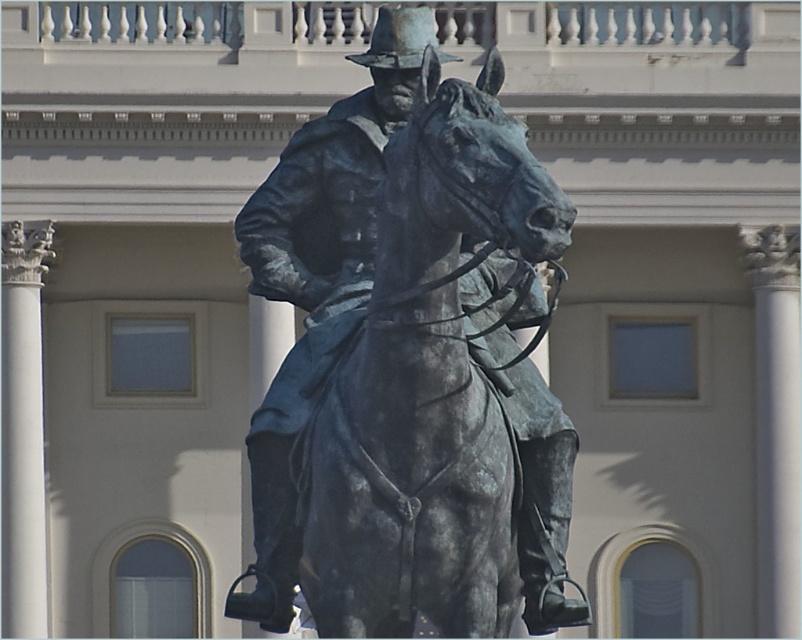
Who is taller, bronze statue at center or shiny bronze cowboy hat at center?

With more height is bronze statue at center.

Is point (501, 342) positioned behind point (351, 54)?

No, it is in front of (351, 54).

Between point (408, 275) and point (383, 10), which one is positioned behind?

The point (383, 10) is more distant.

You are a GUI agent. You are given a task and a screenshot of the screen. Output one action in this format:
    pyautogui.click(x=<x>, y=<y>)
    Task: Click on the bronze statue at center
    The height and width of the screenshot is (640, 802).
    Given the screenshot: What is the action you would take?
    point(412,380)